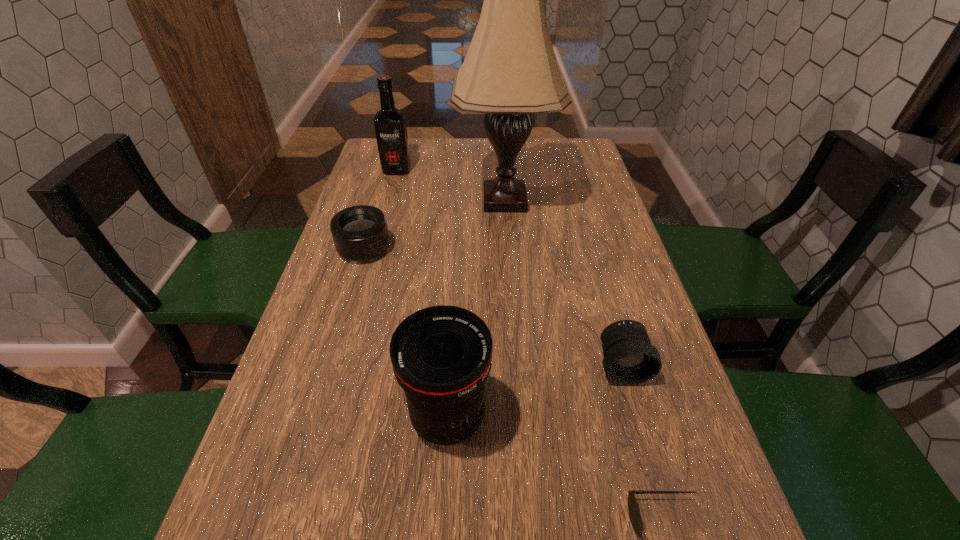
Locate which object ranks fifth in proximity to the liquor. Please provide its 2D coordinates. Your answer should be formatted as a tuple, i.e. [(x, y)], where the tuple contains the x and y coordinates of a point satisfying the conditions above.

[(634, 512)]

At what (x,y) coordinates should I click in order to perform the action: click on the third closest telephoto lens to the second tallest object. Please return your answer as a coordinate pair (x, y). Looking at the image, I should click on (629, 358).

Select which telephoto lens is the second closest to the sunglasses. Please provide its 2D coordinates. Your answer should be formatted as a tuple, i.e. [(x, y)], where the tuple contains the x and y coordinates of a point satisfying the conditions above.

[(441, 356)]

At what (x,y) coordinates should I click in order to perform the action: click on vacant position in the image that satisfies the following two spatial constraints: 1. on the front side of the lamp; 2. on the side of the second shortest object with brand markings and control switches. Please return your answer as a coordinate pair (x, y). The width and height of the screenshot is (960, 540). Looking at the image, I should click on (509, 248).

Where is `free point that satisfies the following two spatial constraints: 1. on the front-facing side of the fifth shortest object; 2. on the side of the fifth tallest object with brand markings and control switches`? The height and width of the screenshot is (540, 960). free point that satisfies the following two spatial constraints: 1. on the front-facing side of the fifth shortest object; 2. on the side of the fifth tallest object with brand markings and control switches is located at coordinates click(x=375, y=248).

Find the location of `blank area in the image that satisfies the following two spatial constraints: 1. on the side of the shortest telephoto lens with brand markings and control switches; 2. on the right side of the fourth shortest object`. blank area in the image that satisfies the following two spatial constraints: 1. on the side of the shortest telephoto lens with brand markings and control switches; 2. on the right side of the fourth shortest object is located at coordinates (314, 418).

You are a GUI agent. You are given a task and a screenshot of the screen. Output one action in this format:
    pyautogui.click(x=<x>, y=<y>)
    Task: Click on the free spot that satisfies the following two spatial constraints: 1. on the side of the third farthest object with brand markings and control switches; 2. on the right side of the third tallest object
    Image resolution: width=960 pixels, height=540 pixels.
    Given the screenshot: What is the action you would take?
    pos(314,418)